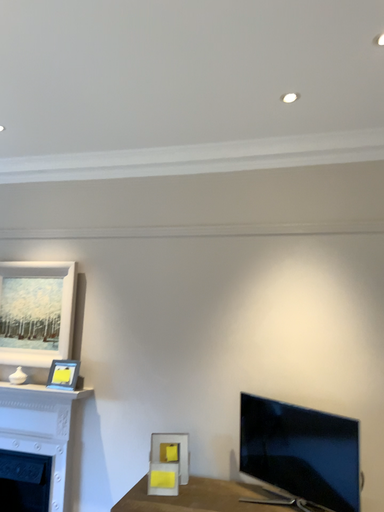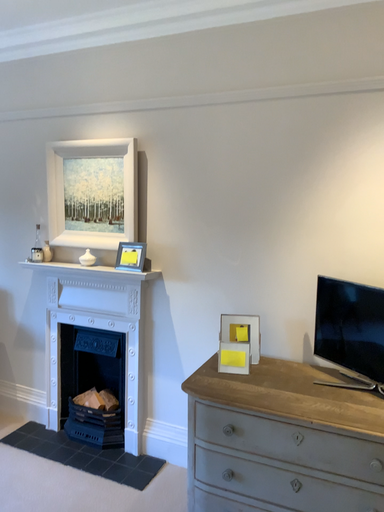
Question: Which way did the camera rotate in the video?

Choices:
 (A) rotated left
 (B) rotated right

Answer: (A)